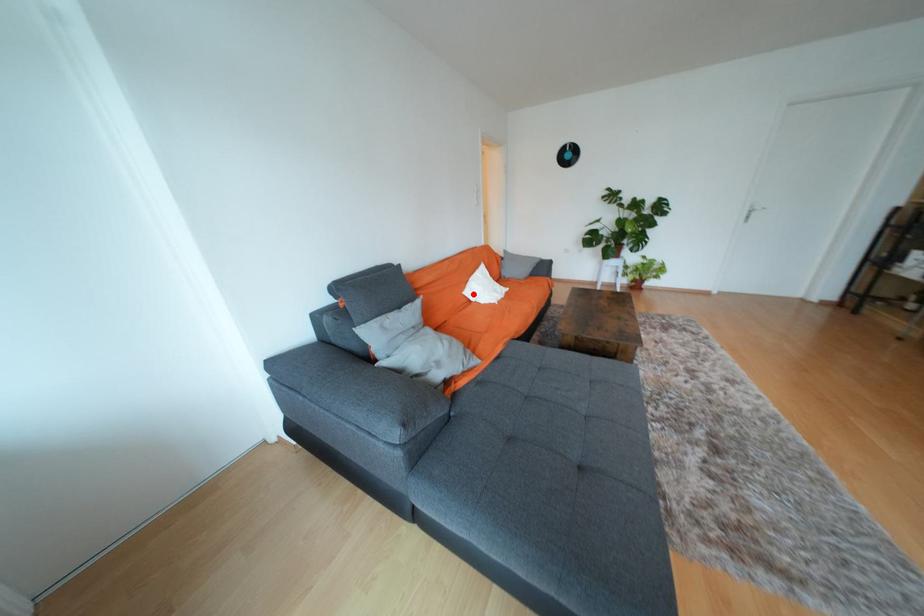
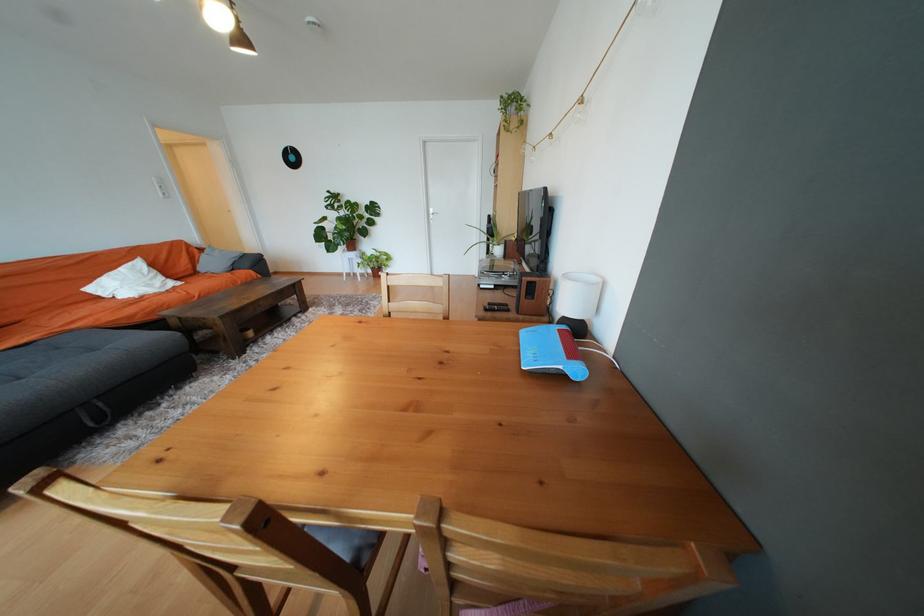
Question: I am providing you with two images of the same scene from different viewpoints. Given a red point in image1, look at the same physical point in image2. Is it:

Choices:
 (A) Closer to the viewpoint
 (B) Farther from the viewpoint

Answer: (B)